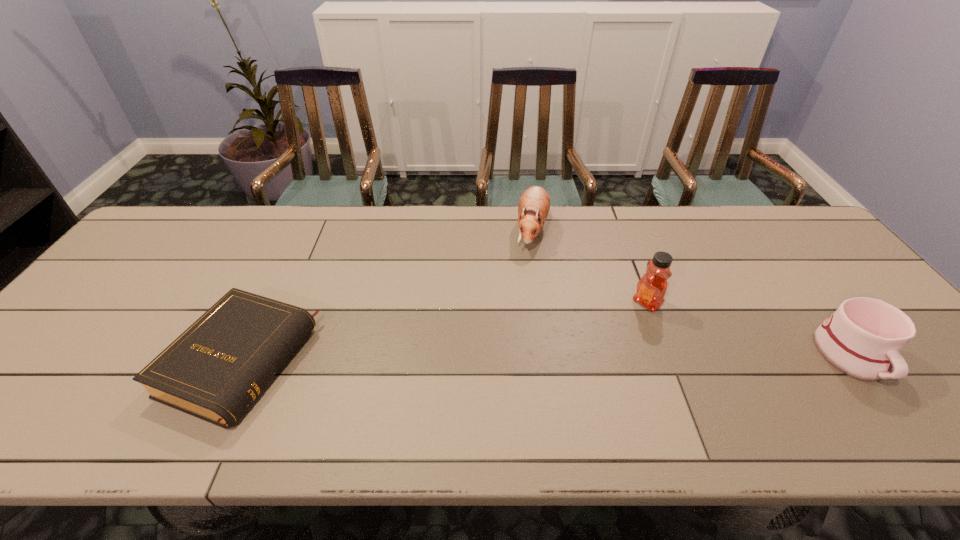
The image size is (960, 540). Find the location of `Bible`. Bible is located at coordinates (215, 369).

You are a GUI agent. You are given a task and a screenshot of the screen. Output one action in this format:
    pyautogui.click(x=<x>, y=<y>)
    Task: Click on the shortest object
    This screenshot has height=540, width=960.
    Given the screenshot: What is the action you would take?
    pyautogui.click(x=215, y=369)

Where is `the rightmost object`? the rightmost object is located at coordinates (863, 339).

This screenshot has height=540, width=960. I want to click on honey, so coord(651,288).

Find the location of `the third object from right to left`. the third object from right to left is located at coordinates (534, 204).

Locate an element on the screen. the farthest object is located at coordinates (534, 204).

This screenshot has height=540, width=960. What are the coordinates of `vacant space located 0.310m on the back of the shortest object` in the screenshot? It's located at (301, 235).

Where is `blank area located on the front label of the third object from left to right`? This screenshot has height=540, width=960. blank area located on the front label of the third object from left to right is located at coordinates (591, 348).

Where is `vacant area situated on the front label of the third object from left to right`? Image resolution: width=960 pixels, height=540 pixels. vacant area situated on the front label of the third object from left to right is located at coordinates (584, 354).

Identify the location of vacant space located 0.070m on the front label of the third object from left to right. (622, 323).